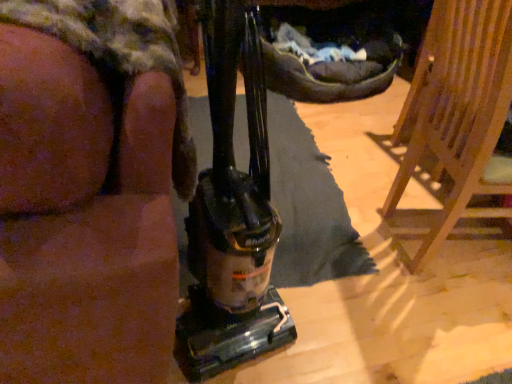
The width and height of the screenshot is (512, 384). I want to click on free space to the left of wooden chair at right, so click(356, 257).